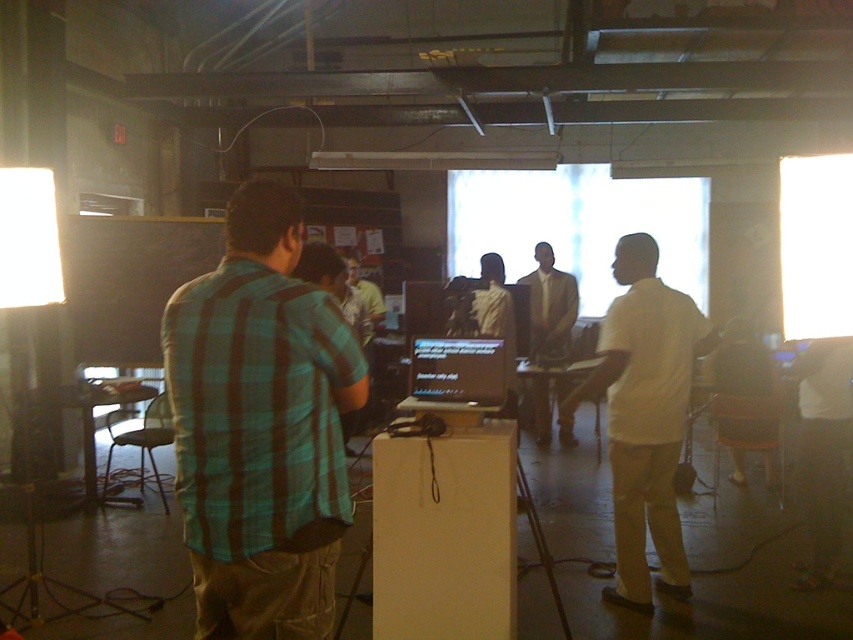
Question: Can you confirm if green plaid shirt at left is positioned to the right of white matte shirt at right?

Choices:
 (A) no
 (B) yes

Answer: (A)

Question: Which object appears closest to the camera in this image?

Choices:
 (A) white matte shirt at right
 (B) green plaid shirt at left

Answer: (B)

Question: From the image, what is the correct spatial relationship of white matte shirt at center in relation to matte black laptop at center?

Choices:
 (A) right
 (B) left

Answer: (A)

Question: Which object is positioned closest to the yellow shirt at center?

Choices:
 (A) white matte shirt at right
 (B) light beige shirt at center
 (C) green plaid shirt at left

Answer: (B)

Question: Does green plaid shirt at left come in front of light beige shirt at center?

Choices:
 (A) no
 (B) yes

Answer: (B)

Question: Which point is closer to the camera taking this photo?

Choices:
 (A) (633, 419)
 (B) (473, 378)
 (C) (537, 314)

Answer: (B)